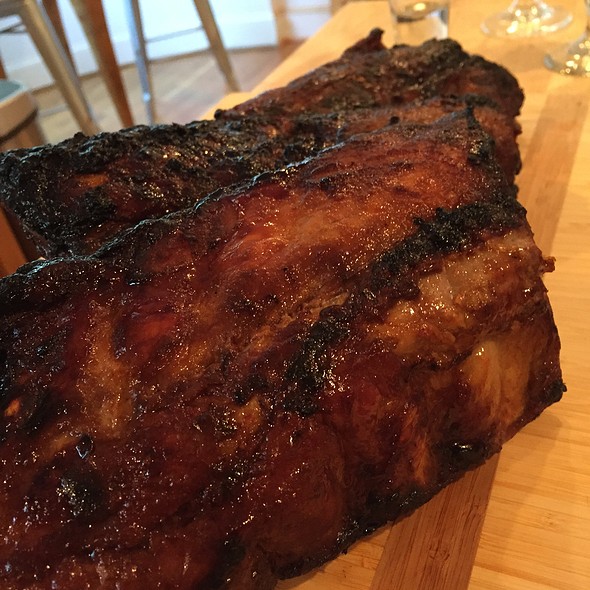
In order to click on side of trashcan in this screenshot , I will do `click(35, 135)`.